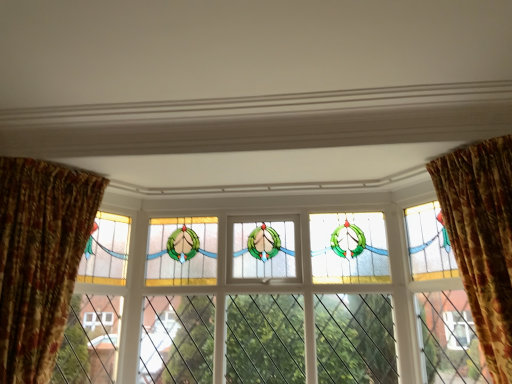
Question: Is floral velvet curtain at left, acting as the 1th curtain starting from the left, oriented towards stained glass window at right?

Choices:
 (A) yes
 (B) no

Answer: (B)

Question: Considering the relative sizes of floral velvet curtain at left, which is the second curtain in right-to-left order, and stained glass window at right in the image provided, is floral velvet curtain at left, which is the second curtain in right-to-left order, taller than stained glass window at right?

Choices:
 (A) yes
 (B) no

Answer: (B)

Question: Is stained glass window at right at the back of floral velvet curtain at left, acting as the 1th curtain starting from the left?

Choices:
 (A) yes
 (B) no

Answer: (B)

Question: From the image's perspective, is floral velvet curtain at left, which is the second curtain in right-to-left order, over stained glass window at right?

Choices:
 (A) no
 (B) yes

Answer: (B)

Question: Does floral velvet curtain at left, acting as the 1th curtain starting from the left, have a smaller size compared to stained glass window at right?

Choices:
 (A) no
 (B) yes

Answer: (A)

Question: From the image's perspective, is floral fabric curtain at right, which is counted as the first curtain, starting from the right, positioned above or below floral velvet curtain at left, acting as the 1th curtain starting from the left?

Choices:
 (A) below
 (B) above

Answer: (B)

Question: Is floral fabric curtain at right, which is counted as the first curtain, starting from the right, inside or outside of floral velvet curtain at left, which is the second curtain in right-to-left order?

Choices:
 (A) inside
 (B) outside

Answer: (B)

Question: In terms of size, does floral fabric curtain at right, which appears as the 2th curtain when viewed from the left, appear bigger or smaller than floral velvet curtain at left, acting as the 1th curtain starting from the left?

Choices:
 (A) big
 (B) small

Answer: (A)

Question: Considering the positions of point (449, 192) and point (8, 233), is point (449, 192) closer or farther from the camera than point (8, 233)?

Choices:
 (A) farther
 (B) closer

Answer: (A)

Question: Looking at their shapes, would you say stained glass window at center is wider or thinner than stained glass window at right?

Choices:
 (A) wide
 (B) thin

Answer: (A)

Question: From their relative heights in the image, would you say stained glass window at center is taller or shorter than stained glass window at right?

Choices:
 (A) tall
 (B) short

Answer: (A)

Question: Is stained glass window at center in front of or behind stained glass window at right in the image?

Choices:
 (A) behind
 (B) front

Answer: (A)

Question: From the image's perspective, is stained glass window at center positioned above or below stained glass window at right?

Choices:
 (A) above
 (B) below

Answer: (B)

Question: Considering the positions of stained glass window at right and floral velvet curtain at left, acting as the 1th curtain starting from the left, in the image, is stained glass window at right wider or thinner than floral velvet curtain at left, acting as the 1th curtain starting from the left,?

Choices:
 (A) wide
 (B) thin

Answer: (B)

Question: Looking at the image, does stained glass window at right seem bigger or smaller compared to floral velvet curtain at left, which is the second curtain in right-to-left order?

Choices:
 (A) big
 (B) small

Answer: (B)